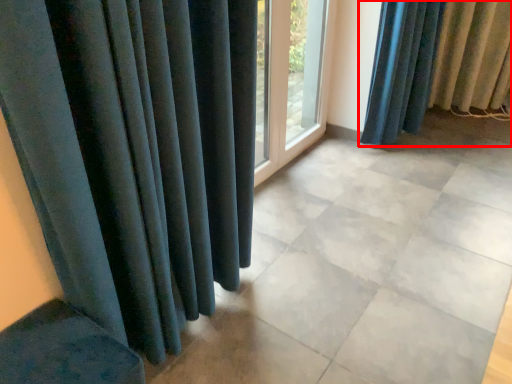
Question: From the image's perspective, what is the correct spatial relationship of curtain (annotated by the red box) in relation to window frame?

Choices:
 (A) below
 (B) above

Answer: (B)